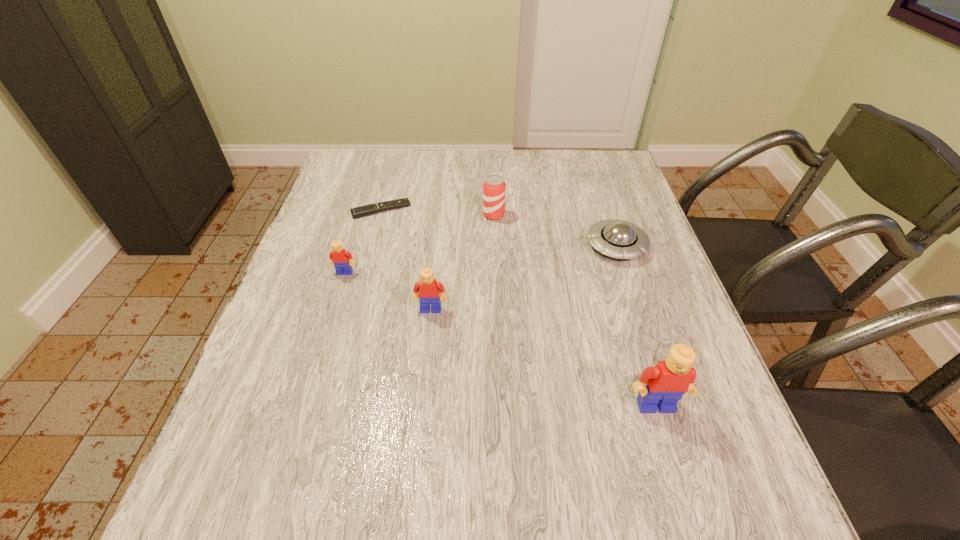
Identify the location of free space located 0.400m on the face of the farthest Lego. (295, 435).

Locate an element on the screen. The height and width of the screenshot is (540, 960). free spot located on the face of the second farthest Lego is located at coordinates (421, 400).

Identify the location of vacant space located 0.300m on the front of the saucer. click(x=659, y=372).

The height and width of the screenshot is (540, 960). Identify the location of free space located 0.350m on the right of the remote control. (534, 210).

This screenshot has height=540, width=960. I want to click on vacant region located 0.060m on the back of the beer can, so click(493, 196).

This screenshot has width=960, height=540. What are the coordinates of `object present at the near edge` in the screenshot? It's located at (661, 387).

Where is `Lego present at the left edge`? Lego present at the left edge is located at coordinates (339, 256).

You are a GUI agent. You are given a task and a screenshot of the screen. Output one action in this format:
    pyautogui.click(x=<x>, y=<y>)
    Task: Click on the remote control that is positioned at the left edge
    
    Given the screenshot: What is the action you would take?
    pyautogui.click(x=357, y=212)

Image resolution: width=960 pixels, height=540 pixels. Find the location of `Lego located at the right edge`. Lego located at the right edge is located at coordinates (661, 387).

At what (x,y) coordinates should I click in order to perform the action: click on saucer that is positioned at the right edge. Please return your answer as a coordinate pair (x, y). Looking at the image, I should click on (620, 239).